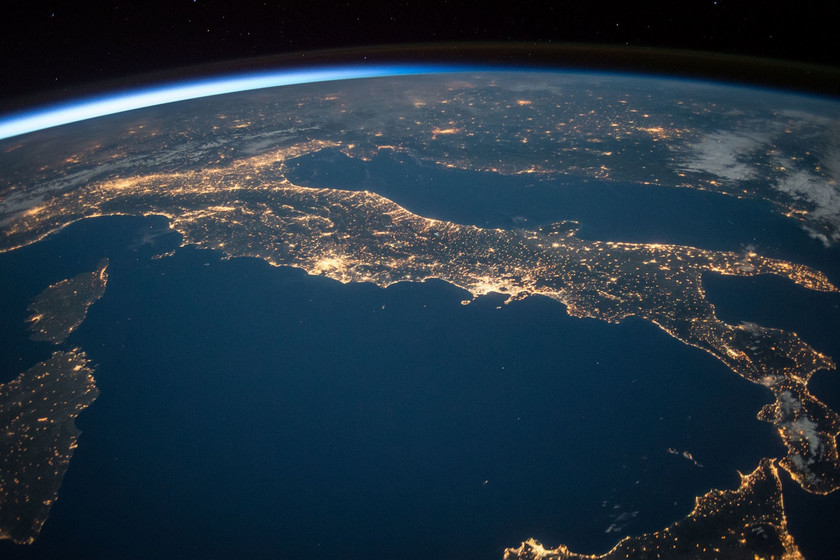
The image size is (840, 560). Find the location of `bright white light`. bright white light is located at coordinates [x=165, y=96].